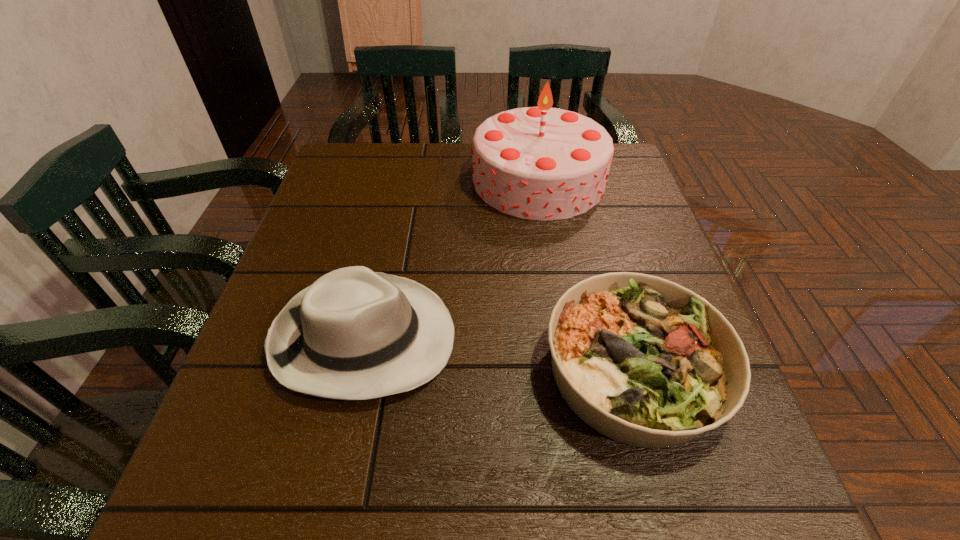
Find the location of a particular element. This screenshot has width=960, height=540. object that is positioned at the left edge is located at coordinates (354, 334).

Where is `birthday cake at the right edge`? birthday cake at the right edge is located at coordinates (540, 163).

At what (x,y) coordinates should I click in order to perform the action: click on salad plate located in the right edge section of the desktop. Please return your answer as a coordinate pair (x, y). Looking at the image, I should click on (644, 361).

The width and height of the screenshot is (960, 540). What are the coordinates of `object at the far right corner` in the screenshot? It's located at (540, 163).

This screenshot has height=540, width=960. In order to click on object located at the near right corner in this screenshot , I will do `click(644, 361)`.

The width and height of the screenshot is (960, 540). I want to click on vacant space at the near edge, so click(581, 494).

At what (x,y) coordinates should I click in order to perform the action: click on blank space at the left edge. Please return your answer as a coordinate pair (x, y). This screenshot has width=960, height=540. Looking at the image, I should click on (288, 265).

Where is `vacant space at the right edge of the desktop`? vacant space at the right edge of the desktop is located at coordinates (747, 449).

Locate an element on the screen. This screenshot has height=540, width=960. vacant space at the far left corner of the desktop is located at coordinates (363, 142).

Find the location of a particular element. The height and width of the screenshot is (540, 960). free space at the near left corner is located at coordinates (276, 499).